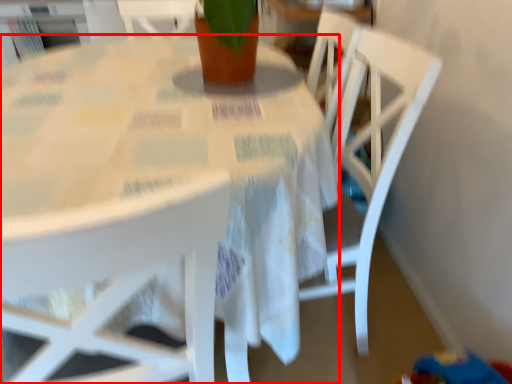
Question: From the image's perspective, where is table (annotated by the red box) located relative to chair?

Choices:
 (A) above
 (B) below

Answer: (A)